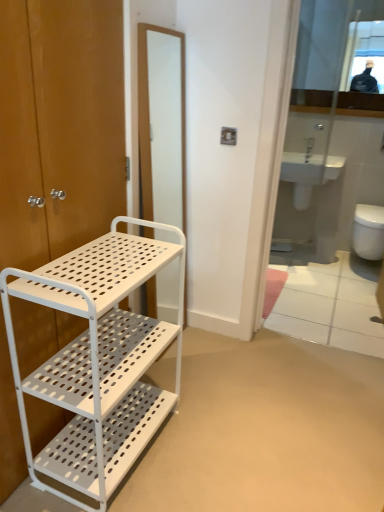
Where is `free space underneath glossy glass mirror at upper right, acting as the 2th mirror starting from the front (from a real-world perspective)`? This screenshot has height=512, width=384. free space underneath glossy glass mirror at upper right, acting as the 2th mirror starting from the front (from a real-world perspective) is located at coordinates (320, 223).